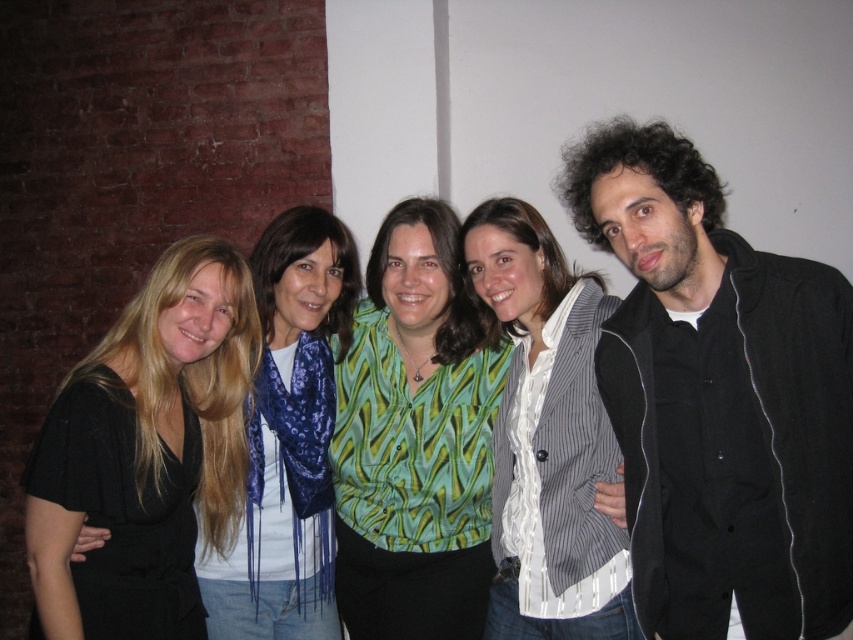
You are a photographer standing at a distance of 6 feet from the group. You want to take a closeup shot of the black matte dress at left without moving closer. Can you do that using a standard zoom lens with a maximum zoom range of 100mm?

The black matte dress at left is 5.29 feet away from the camera. Since you are 6 feet away from the group and the dress is only 5.29 feet from the camera, you are slightly too far to capture a closeup without moving closer. A standard zoom lens at 100mm might not be sufficient to compensate for the distance difference.

You are a photographer adjusting the lighting in the studio. You notice the black matte jacket at center and the green printed blouse at center. Which clothing item is covering the other one in the image?

The black matte jacket at center is positioned over the green printed blouse at center, so the jacket is covering the blouse.